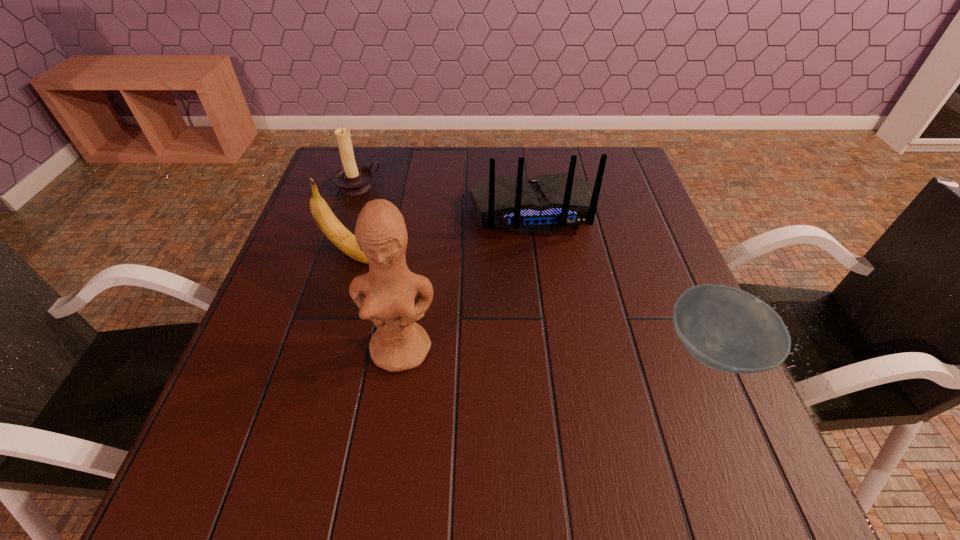
Locate an element on the screen. This screenshot has width=960, height=540. vacant space on the desktop that is between the tallest object and the shortest object and is positioned at the start of the peel on the banana is located at coordinates (523, 349).

You are a GUI agent. You are given a task and a screenshot of the screen. Output one action in this format:
    pyautogui.click(x=<x>, y=<y>)
    Task: Click on the vacant spot on the desktop that is between the figurine and the bowl and is positioned on the wick of the candle holder
    
    Given the screenshot: What is the action you would take?
    pyautogui.click(x=556, y=349)

Image resolution: width=960 pixels, height=540 pixels. I want to click on free space on the desktop that is between the figurine and the rightmost object and is positioned on the back of the router, so click(x=565, y=349).